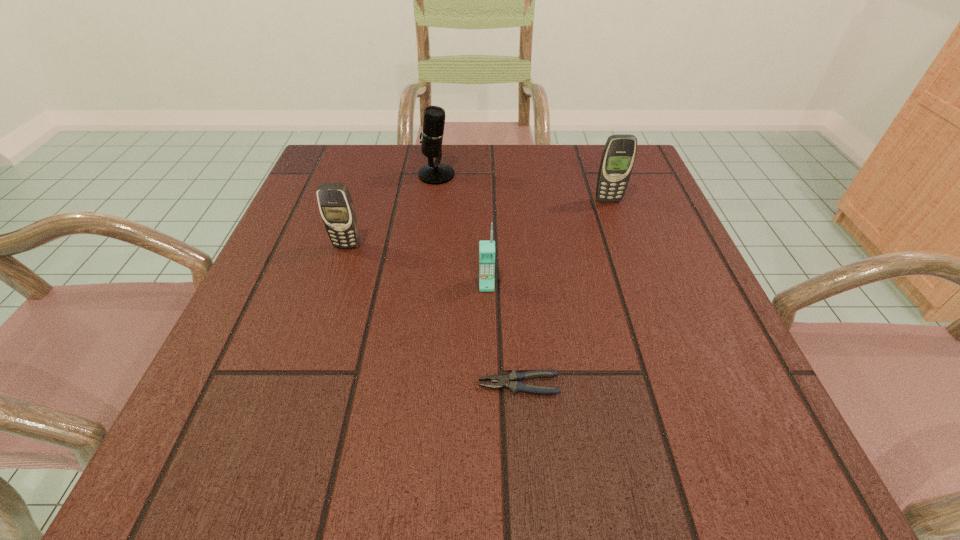
This screenshot has height=540, width=960. What are the coordinates of `blank region between the shortest object and the microphone` in the screenshot? It's located at (477, 280).

Where is `blank region between the second nearest object and the farthest object`? blank region between the second nearest object and the farthest object is located at coordinates (462, 230).

Find the location of `unoccupied position between the third farthest object and the microphone`. unoccupied position between the third farthest object and the microphone is located at coordinates (392, 210).

The height and width of the screenshot is (540, 960). Find the location of `free space between the second cellular telephone from left to right and the microphone`. free space between the second cellular telephone from left to right and the microphone is located at coordinates (462, 230).

Locate an element on the screen. Image resolution: width=960 pixels, height=540 pixels. free space that is in between the second object from left to right and the leftmost object is located at coordinates (392, 210).

In order to click on free space between the microphone and the nearest cellular telephone in this screenshot , I will do `click(462, 230)`.

This screenshot has height=540, width=960. I want to click on free space that is in between the pliers and the second farthest object, so click(x=564, y=293).

What are the coordinates of `free space between the farthest object and the rightmost cellular telephone` in the screenshot? It's located at (522, 187).

At what (x,y) coordinates should I click in order to perform the action: click on empty location between the farthest object and the pliers. Please return your answer as a coordinate pair (x, y). The image size is (960, 540). Looking at the image, I should click on (477, 280).

Identify which object is located as the third nearest to the farthest cellular telephone. Please provide its 2D coordinates. Your answer should be formatted as a tuple, i.e. [(x, y)], where the tuple contains the x and y coordinates of a point satisfying the conditions above.

[(514, 385)]